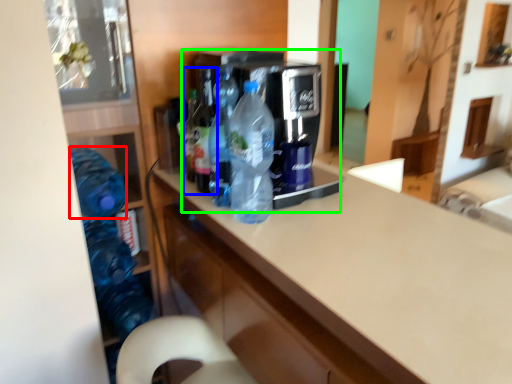
Question: Which is farther away from bottle (highlighted by a red box)? bottle (highlighted by a blue box) or appliance (highlighted by a green box)?

Choices:
 (A) bottle
 (B) appliance

Answer: (B)